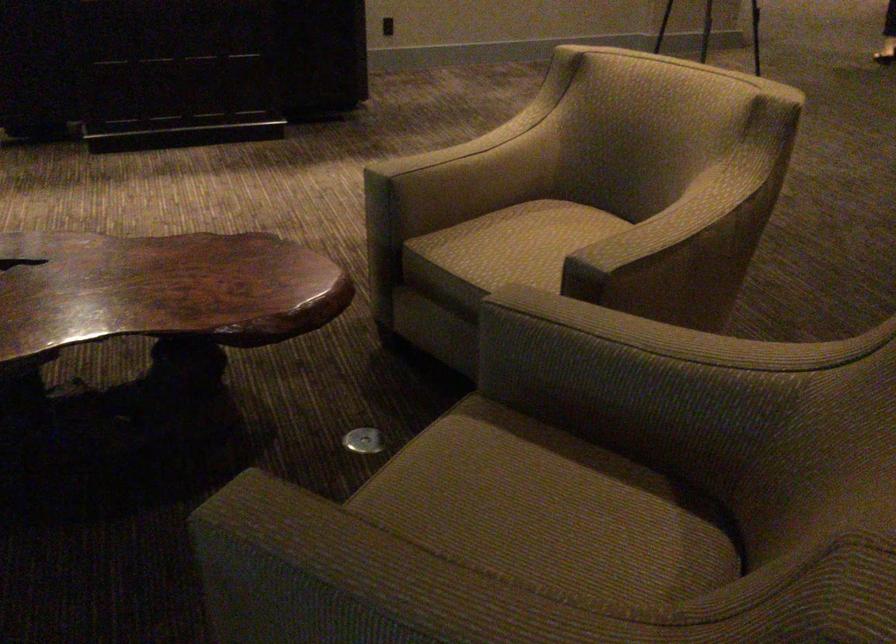
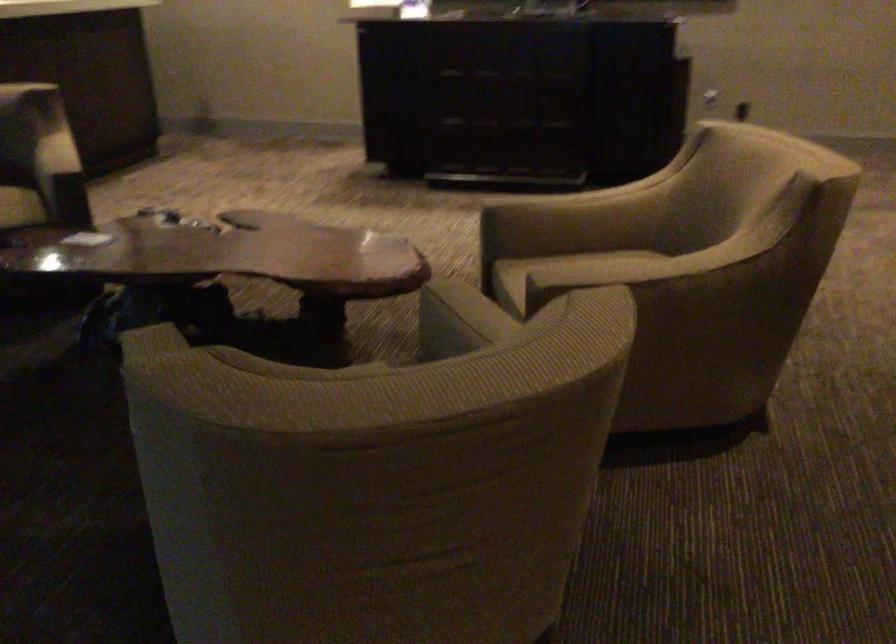
Locate, in the second image, the point that corresponds to (x=641, y=240) in the first image.

(599, 272)